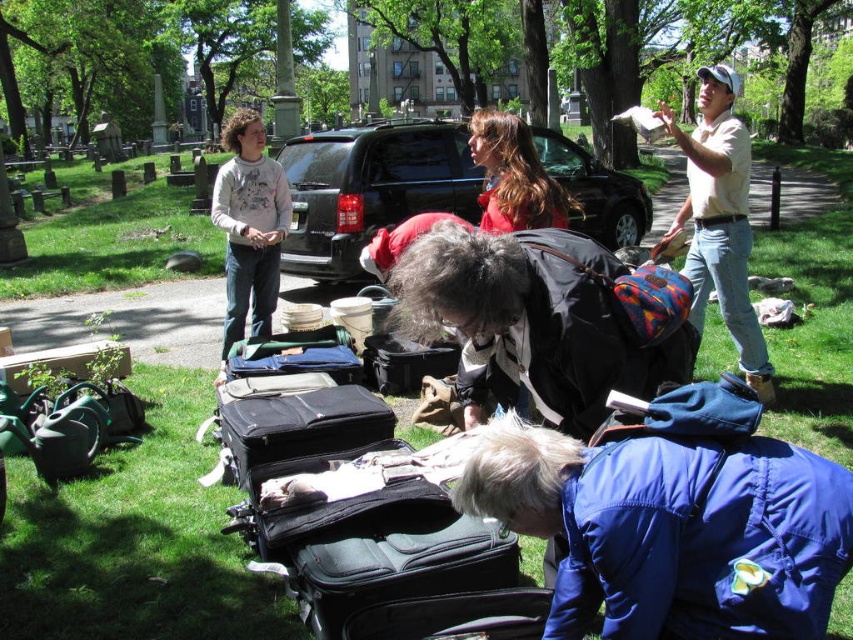
Which of these two, black leather jacket at center or black matte suitcase at center, stands shorter?

black matte suitcase at center

Between point (474, 410) and point (247, 480), which one is positioned behind?

The point (247, 480) is more distant.

Locate an element on the screen. black leather jacket at center is located at coordinates pyautogui.click(x=535, y=321).

From the picture: Is black matte suv at center smaller than black matte suitcase at center?

Actually, black matte suv at center might be larger than black matte suitcase at center.

Is black matte suv at center thinner than black matte suitcase at center?

No.

Is point (312, 211) closer to viewer compared to point (328, 416)?

No, it is not.

The image size is (853, 640). In order to click on black matte suv at center in this screenshot , I will do `click(370, 188)`.

Measure the distance from black matte suitcase at center to red wool coat at center.

black matte suitcase at center is 1.82 meters away from red wool coat at center.

Can you confirm if black matte suitcase at center is shorter than red wool coat at center?

Yes, black matte suitcase at center is shorter than red wool coat at center.

This screenshot has height=640, width=853. Describe the element at coordinates (300, 429) in the screenshot. I see `black matte suitcase at center` at that location.

The height and width of the screenshot is (640, 853). In order to click on black matte suitcase at center in this screenshot , I will do `click(300, 429)`.